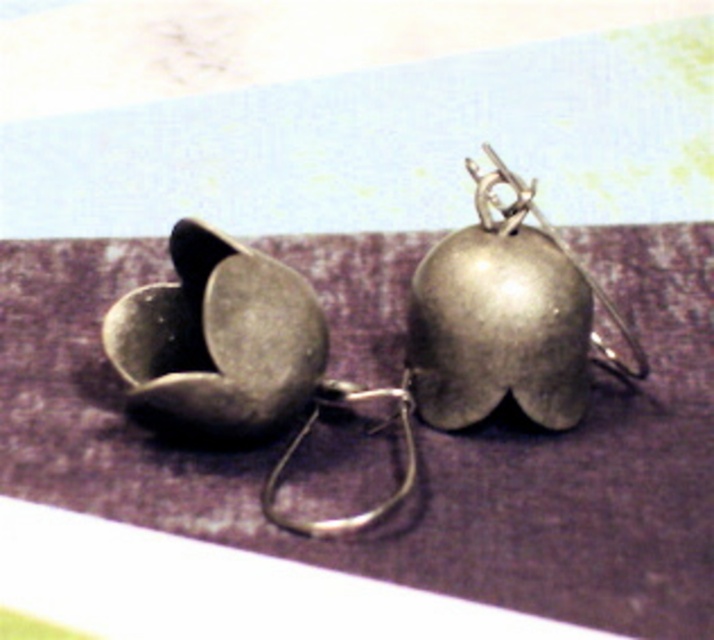
Question: Among these points, which one is farthest from the camera?

Choices:
 (A) coord(478,209)
 (B) coord(397,412)

Answer: (B)

Question: Is metallic purple mat at center closer to the viewer compared to polished silver hook at center?

Choices:
 (A) yes
 (B) no

Answer: (A)

Question: Observing the image, what is the correct spatial positioning of metallic purple mat at center in reference to silver/metallic hook at center?

Choices:
 (A) right
 (B) left

Answer: (A)

Question: Can you confirm if silver/metallic hook at center is positioned below polished silver hook at center?

Choices:
 (A) yes
 (B) no

Answer: (A)

Question: Among these objects, which one is farthest from the camera?

Choices:
 (A) metallic purple mat at center
 (B) polished silver hook at center
 (C) silver/metallic hook at center

Answer: (B)

Question: Which point is closer to the camera?

Choices:
 (A) (550, 227)
 (B) (150, 440)
 (C) (376, 397)

Answer: (A)